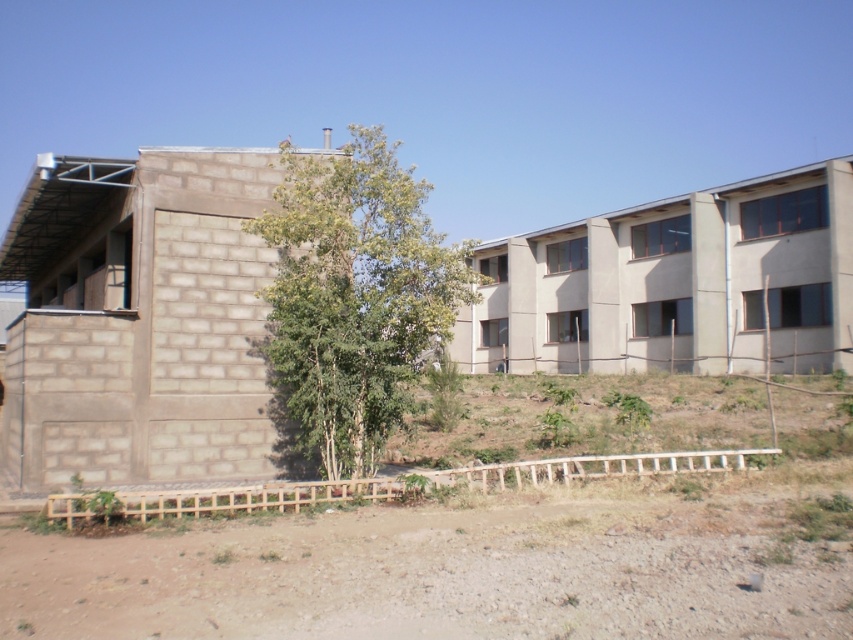
You are a gardener planning to plant flowers in the brown dirt field at lower center. Considering the position of the green leafy tree at center, will the flowers receive enough sunlight? Please explain your reasoning.

The brown dirt field at lower center is positioned under the green leafy tree at center, which means the tree may block sunlight from reaching the flowers. Therefore, the flowers might not receive enough sunlight for healthy growth.

You are a construction worker standing at the wooden fence in the foreground. You need to reach the unfinished section of the building on the left side. Which direction should you walk to avoid stepping on the brown dirt field at lower center?

To avoid stepping on the brown dirt field at lower center, you should walk towards the left side of the building, as the field is located at point (x=474, y=560), which is to the right of the building. Walking towards the left side would keep you away from the dirt field.